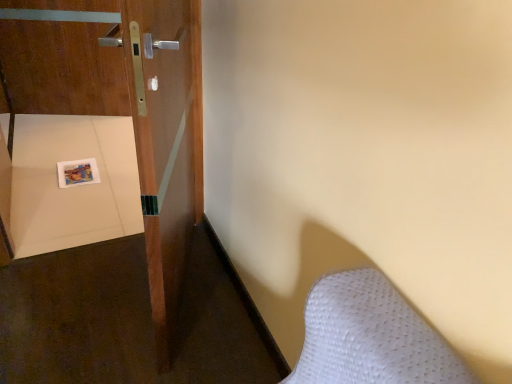
Question: Is wooden door at left inside or outside of matte plastic tray at lower left?

Choices:
 (A) inside
 (B) outside

Answer: (B)

Question: Is point (62, 92) positioned closer to the camera than point (92, 180)?

Choices:
 (A) closer
 (B) farther

Answer: (B)

Question: In terms of width, does wooden door at left look wider or thinner when compared to matte plastic tray at lower left?

Choices:
 (A) wide
 (B) thin

Answer: (B)

Question: Would you say matte plastic tray at lower left is inside or outside wooden door at left?

Choices:
 (A) outside
 (B) inside

Answer: (A)

Question: From the image's perspective, is matte plastic tray at lower left located above or below wooden door at left?

Choices:
 (A) below
 (B) above

Answer: (A)

Question: Is matte plastic tray at lower left in front of or behind wooden door at left in the image?

Choices:
 (A) front
 (B) behind

Answer: (B)

Question: Is matte plastic tray at lower left wider or thinner than wooden door at left?

Choices:
 (A) wide
 (B) thin

Answer: (A)